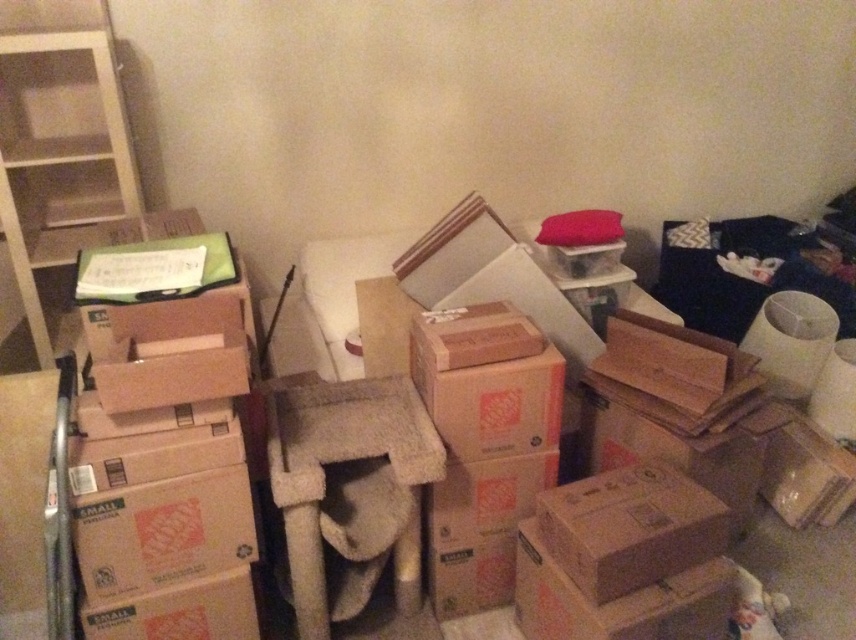
Question: Which point is closer to the camera taking this photo?

Choices:
 (A) (197, 440)
 (B) (128, 145)

Answer: (A)

Question: Can you confirm if brown cardboard box at left is positioned to the right of white wood bookshelf at upper left?

Choices:
 (A) yes
 (B) no

Answer: (A)

Question: Is brown cardboard box at left positioned behind white wood bookshelf at upper left?

Choices:
 (A) yes
 (B) no

Answer: (B)

Question: Is brown cardboard box at left to the left of white wood bookshelf at upper left from the viewer's perspective?

Choices:
 (A) no
 (B) yes

Answer: (A)

Question: Which point is farther to the camera?

Choices:
 (A) brown cardboard box at left
 (B) white wood bookshelf at upper left

Answer: (B)